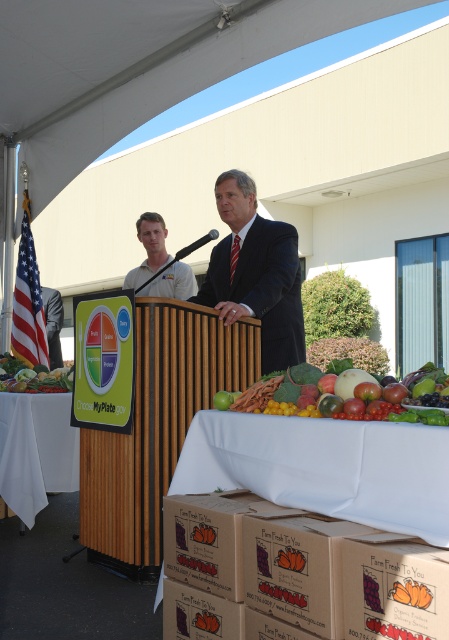
Question: Is dark blue suit at center to the left of white cloth-covered table at lower left from the viewer's perspective?

Choices:
 (A) yes
 (B) no

Answer: (B)

Question: Is the position of green leafy lettuce at center more distant than that of green leafy vegetable at left?

Choices:
 (A) no
 (B) yes

Answer: (A)

Question: Which object is closer to the camera taking this photo?

Choices:
 (A) green leafy lettuce at center
 (B) white cotton shirt at center

Answer: (A)

Question: Estimate the real-world distances between objects in this image. Which object is farther from the green leafy lettuce at center?

Choices:
 (A) dark blue suit at center
 (B) cardboard box with printed graphics at center
 (C) white cardboard boxes at lower center

Answer: (A)

Question: Among these points, which one is nearest to the camera?

Choices:
 (A) (164, 634)
 (B) (44, 376)

Answer: (A)

Question: Does white cardboard boxes at lower center appear on the right side of brown cardboard box at center?

Choices:
 (A) no
 (B) yes

Answer: (B)